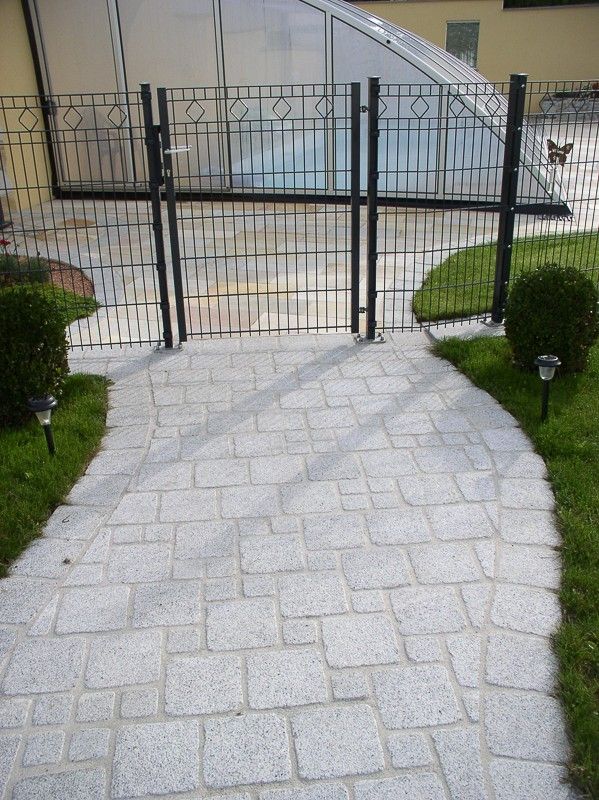
The image size is (599, 800). Find the location of `window`. window is located at coordinates (459, 50).